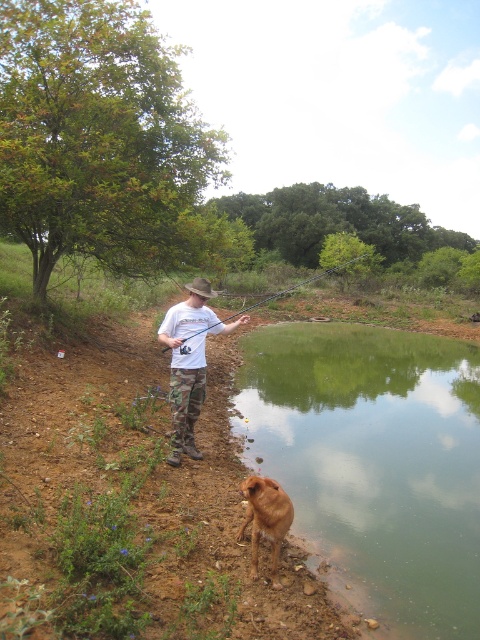
You are standing at the point with coordinates point (x=197, y=280) and want to walk towards the point with coordinates point (x=195, y=298). Which direction should you move in?

You should move towards the camera direction because point (x=195, y=298) is further to the camera than point (x=197, y=280).

You are standing at the edge of the pond and want to throw a stone into the green smooth water at lower center. To do this, should you aim to your left or right of the white matte shirt at center?

The green smooth water at lower center is to the right of the white matte shirt at center, so you should aim to your right of the white matte shirt at center to hit the green smooth water at lower center.

You are a visitor at the pond and want to know if the brown furry dog at lower center is smaller in size compared to the black rod at center. Can you confirm?

The brown furry dog at lower center occupies less space than the black rod at center, so yes, the brown furry dog at lower center is smaller in size compared to the black rod at center.